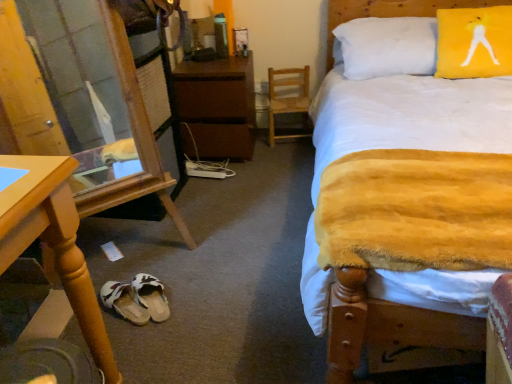
Identify the location of vacant space in front of wooden swivel chair at center. (288, 153).